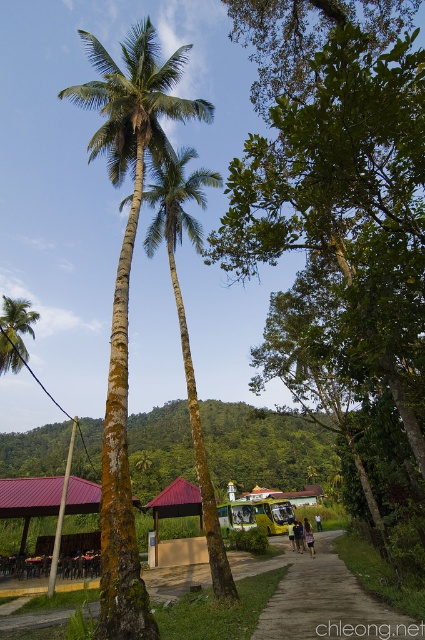
You are planning to build a small garden along the brown dirt path at center and the green bark palm trees at center. Which area would you choose for the garden and why?

The green bark palm trees at center occupy more space than the brown dirt path at center, so the garden should be placed near the green bark palm trees at center for more space.